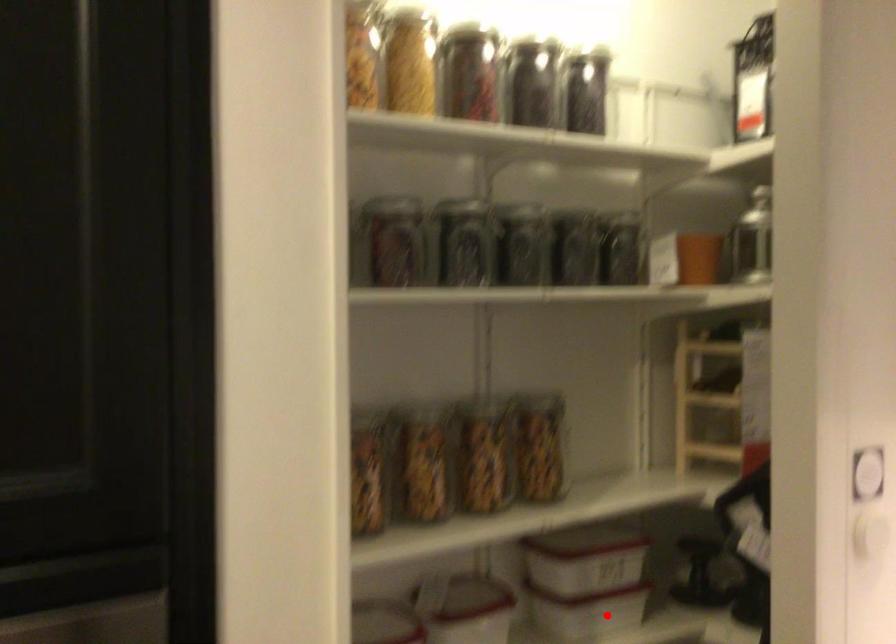
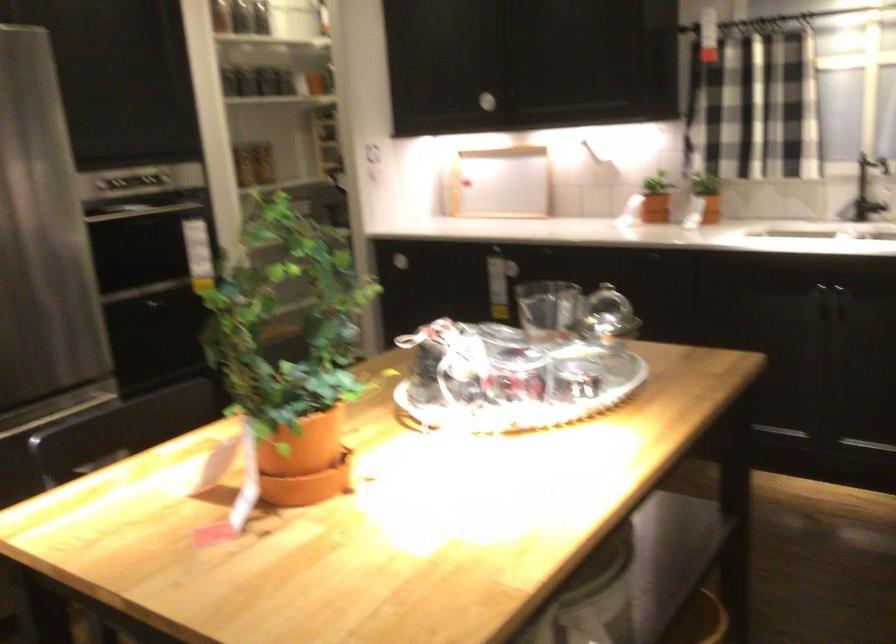
Question: I am providing you with two images of the same scene from different viewpoints. A red point is marked on the first image. Is the red point's position out of view in image 2?

Choices:
 (A) Yes
 (B) No

Answer: (A)